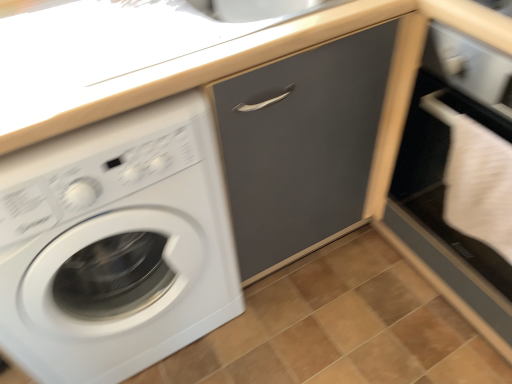
Question: Considering the positions of brown wooden tile at lower center and white glossy washing machine at left in the image, is brown wooden tile at lower center wider or thinner than white glossy washing machine at left?

Choices:
 (A) wide
 (B) thin

Answer: (A)

Question: Considering the positions of brown wooden tile at lower center and white glossy washing machine at left in the image, is brown wooden tile at lower center bigger or smaller than white glossy washing machine at left?

Choices:
 (A) small
 (B) big

Answer: (A)

Question: Which of these objects is positioned farthest from the white matte file cabinet at lower right?

Choices:
 (A) matte gray drawer at center
 (B) brown wooden tile at lower center
 (C) white glossy washing machine at left

Answer: (C)

Question: Which object is the closest to the matte gray drawer at center?

Choices:
 (A) white glossy washing machine at left
 (B) brown wooden tile at lower center
 (C) white matte file cabinet at lower right

Answer: (C)